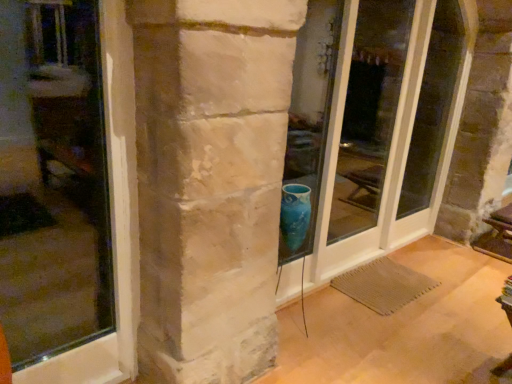
This screenshot has height=384, width=512. Find the location of `white glossy door at center`. white glossy door at center is located at coordinates (391, 126).

Describe the element at coordinates (391, 126) in the screenshot. I see `white glossy door at center` at that location.

Identify the location of white glossy door at center. (391, 126).